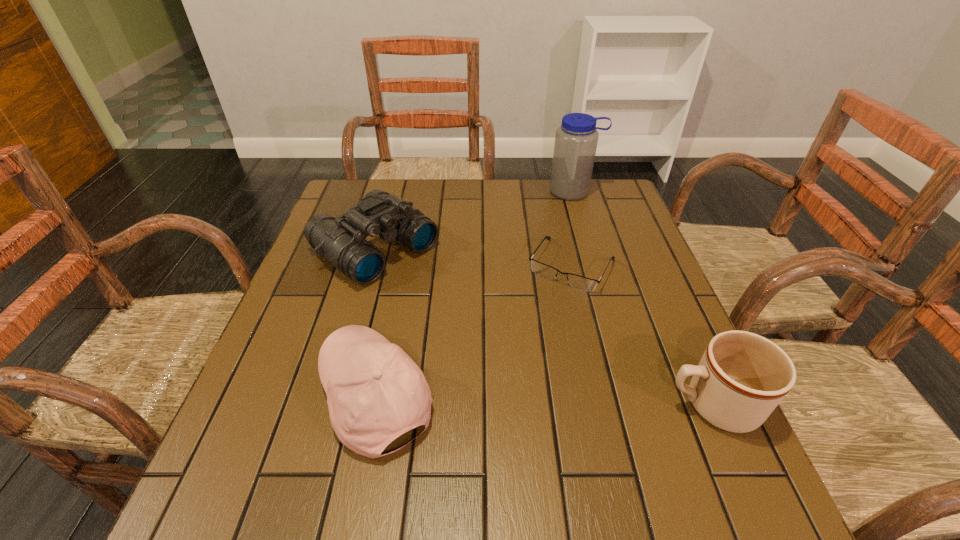
Identify the location of vacant space that satisfies the following two spatial constraints: 1. on the front side of the mug; 2. on the side of the spectacles with the handle. (605, 404).

You are a GUI agent. You are given a task and a screenshot of the screen. Output one action in this format:
    pyautogui.click(x=<x>, y=<y>)
    Task: Click on the free space that satisfies the following two spatial constraints: 1. on the front side of the binoculars; 2. on the right side of the shortest object
    The height and width of the screenshot is (540, 960).
    Given the screenshot: What is the action you would take?
    pyautogui.click(x=370, y=266)

Locate an element on the screen. vacant space that satisfies the following two spatial constraints: 1. on the front side of the baseball cap; 2. on the front-facing side of the binoculars is located at coordinates (333, 396).

Where is `free region that satisfies the following two spatial constraints: 1. on the front side of the mug; 2. on the side of the binoculars with the handle`? free region that satisfies the following two spatial constraints: 1. on the front side of the mug; 2. on the side of the binoculars with the handle is located at coordinates (330, 404).